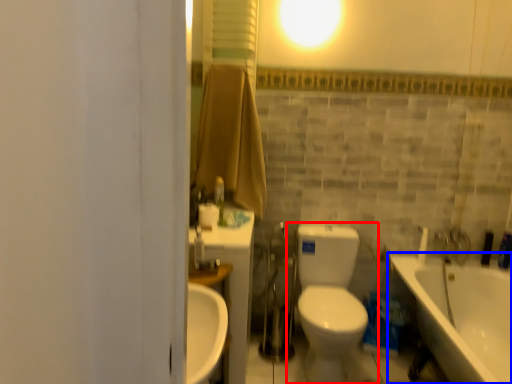
Question: Which object is further to the camera taking this photo, toilet (highlighted by a red box) or bathtub (highlighted by a blue box)?

Choices:
 (A) toilet
 (B) bathtub

Answer: (A)